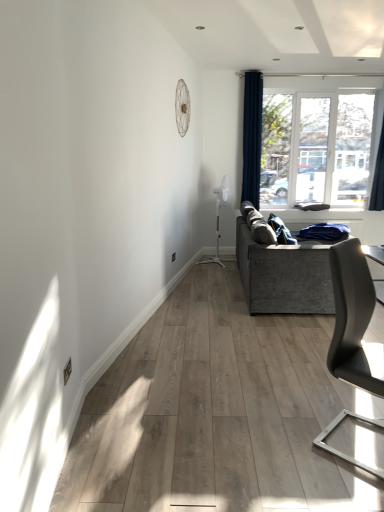
Locate an element on the screen. This screenshot has width=384, height=512. vacant space underneath matte gray chair at right (from a real-world perspective) is located at coordinates (354, 433).